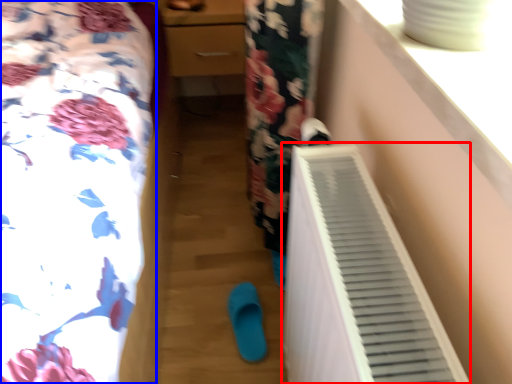
Question: Which point is closer to the camera, air conditioning (highlighted by a red box) or furniture (highlighted by a blue box)?

Choices:
 (A) air conditioning
 (B) furniture

Answer: (B)